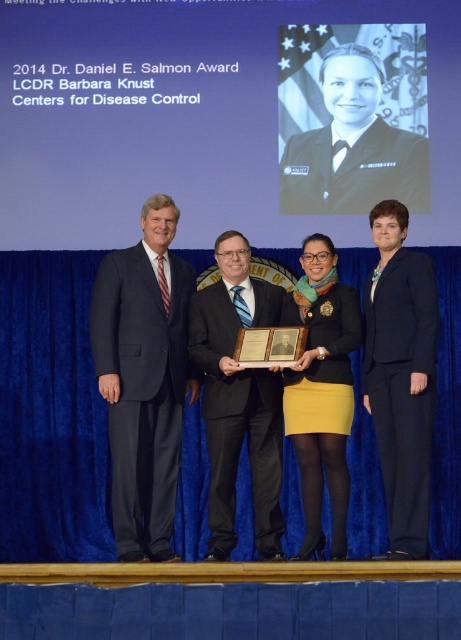
Question: Which point is closer to the camera?

Choices:
 (A) matte black blazer at center
 (B) black suit at center
 (C) dark blue suit at left
 (D) black suit at right

Answer: (D)

Question: Is dark blue suit at left thinner than matte black blazer at center?

Choices:
 (A) no
 (B) yes

Answer: (A)

Question: Does dark blue suit at left have a greater width compared to black suit at center?

Choices:
 (A) yes
 (B) no

Answer: (A)

Question: Which of these objects is positioned closest to the black suit at center?

Choices:
 (A) black suit at right
 (B) matte black blazer at center
 (C) dark blue suit at left

Answer: (B)

Question: Which point is closer to the camera?

Choices:
 (A) dark blue suit at left
 (B) black suit at right

Answer: (B)

Question: Is black suit at center below matte black blazer at center?

Choices:
 (A) yes
 (B) no

Answer: (A)